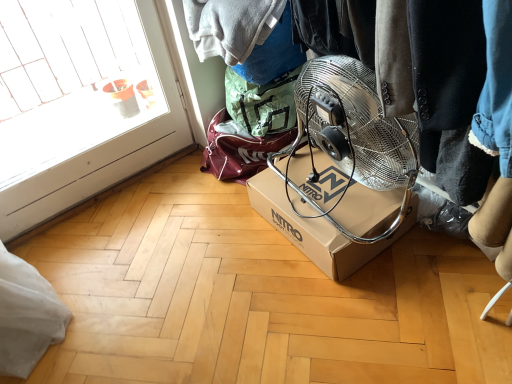
Find the location of a particular element. free point below transparent glass door at left (from a real-world perspective) is located at coordinates (106, 193).